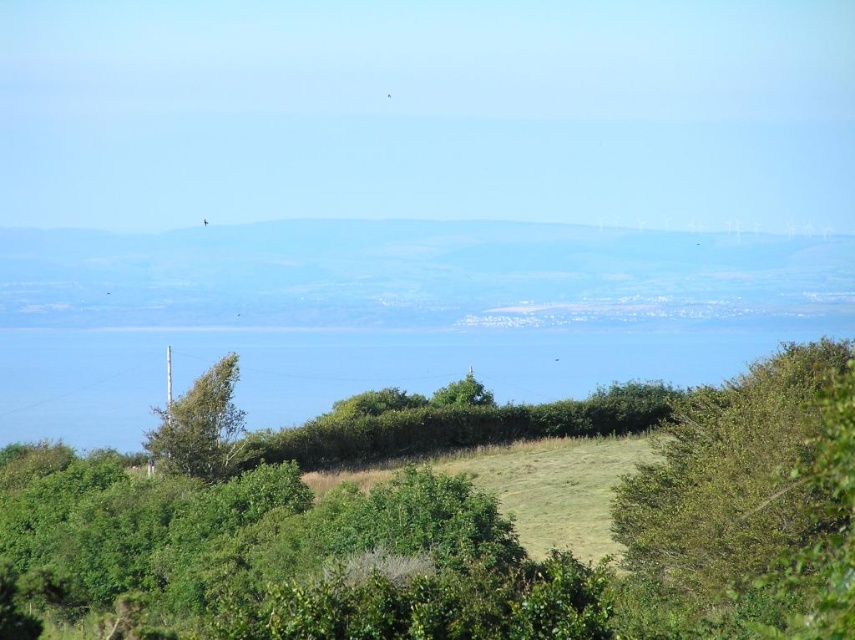
Between green leafy bush at lower right and green leafy tree at lower left, which one has more height?

green leafy bush at lower right

Locate an element on the screen. green leafy bush at lower right is located at coordinates (741, 481).

Between green grassy hill at center and green leafy bush at lower right, which one has less height?

green leafy bush at lower right is shorter.

Between green grassy hill at center and green leafy bush at lower right, which one appears on the left side from the viewer's perspective?

green grassy hill at center is more to the left.

Between point (684, 582) and point (776, 372), which one is positioned behind?

The point (776, 372) is behind.

This screenshot has height=640, width=855. I want to click on green grassy hill at center, so click(x=461, y=528).

The width and height of the screenshot is (855, 640). Describe the element at coordinates (461, 528) in the screenshot. I see `green grassy hill at center` at that location.

Who is shorter, green grassy hill at center or green leafy tree at lower left?

green leafy tree at lower left is shorter.

Which is in front, point (685, 429) or point (233, 372)?

Point (685, 429)

You are a GUI agent. You are given a task and a screenshot of the screen. Output one action in this format:
    pyautogui.click(x=<x>, y=<y>)
    Task: Click on the green grassy hill at center
    This screenshot has height=640, width=855.
    Given the screenshot: What is the action you would take?
    pyautogui.click(x=461, y=528)